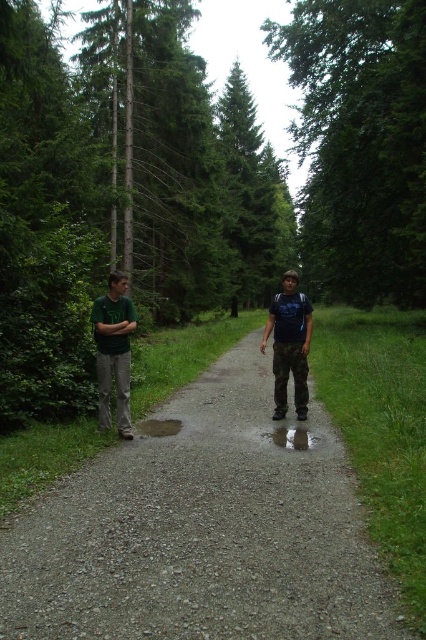
You are a hiker on the gravel path in the forest. You notice two shirts hanging on a nearby tree branch. The shirts are the green fabric shirt at center and the green matte shirt at left. Which shirt is closer to you?

The green fabric shirt at center is closer to you because it is positioned over the green matte shirt at left, indicating it is in front.

You are standing on the gravel path in the forest and want to take a photo of the green leafy tree at center. Your camera can focus on objects up to 15 meters away. Will the tree be in focus?

The green leafy tree at center is 14.93 meters from viewer, so yes, the camera can focus on it since it is within the 15 meters range.

You are standing on the gravel path in the forest and see the green leafy tree at center and the green fabric shirt at center. Which object is positioned to the right of the other?

The green leafy tree at center is to the right of the green fabric shirt at center.